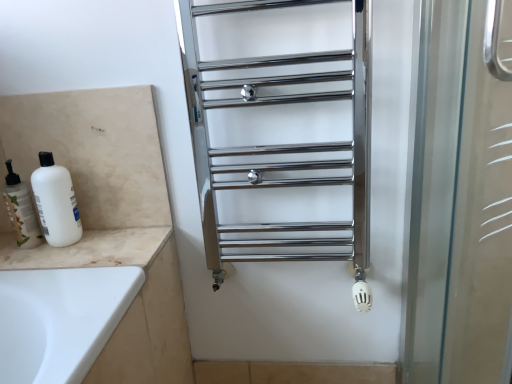
Identify the location of blank space above beige marble counter top at lower left (from a real-world perspective). (54, 244).